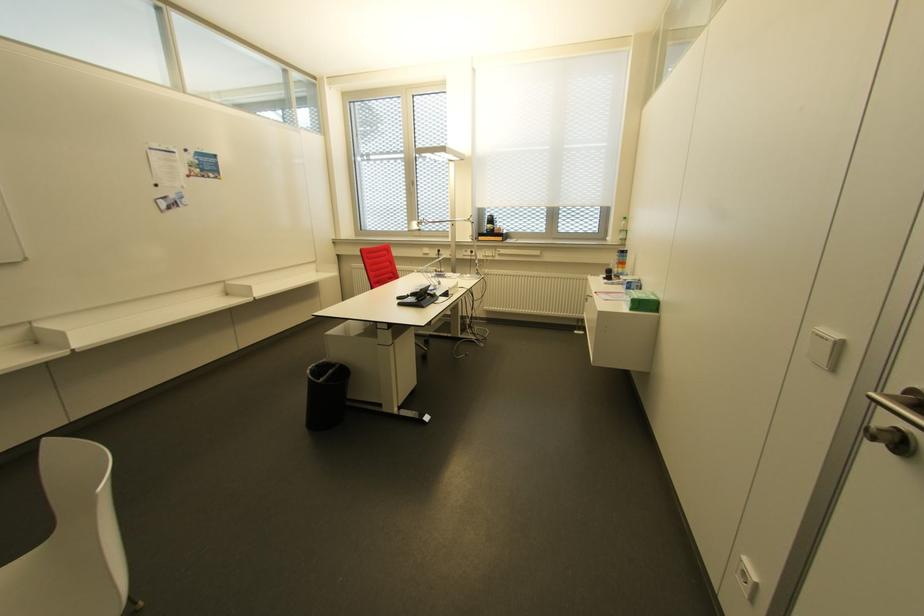
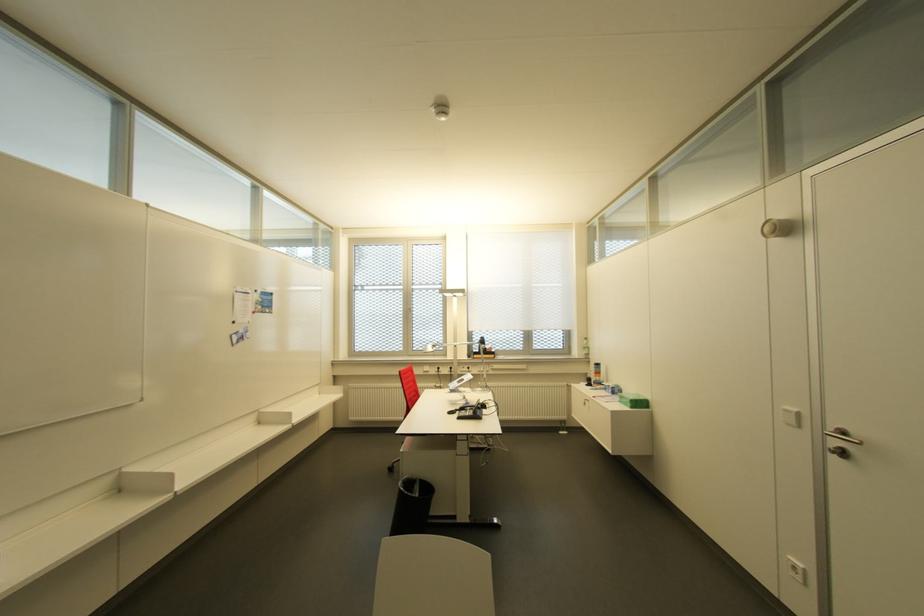
The images are taken continuously from a first-person perspective. In which direction are you moving?

The cameraman moved toward left, backward.